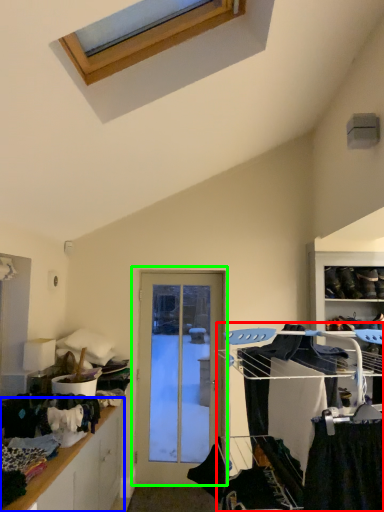
Question: Considering the real-world distances, which object is closest to bunk bed (highlighted by a red box)? cabinetry (highlighted by a blue box) or door (highlighted by a green box).

Choices:
 (A) cabinetry
 (B) door

Answer: (A)